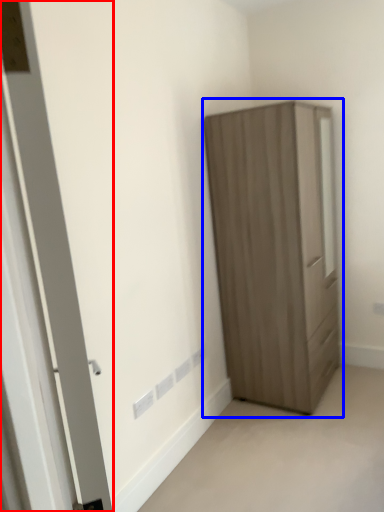
Question: Which point is further to the camera, door (highlighted by a red box) or cupboard (highlighted by a blue box)?

Choices:
 (A) door
 (B) cupboard

Answer: (B)